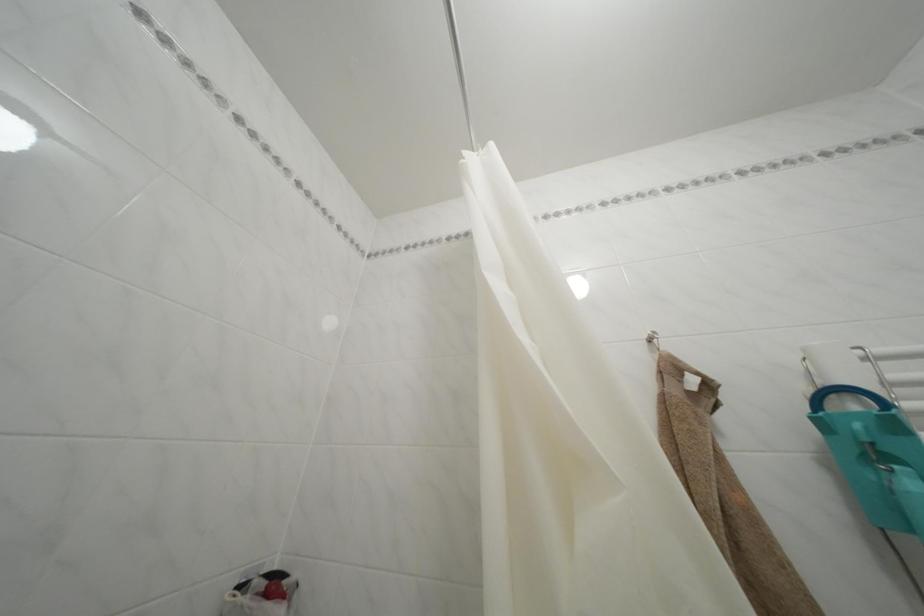
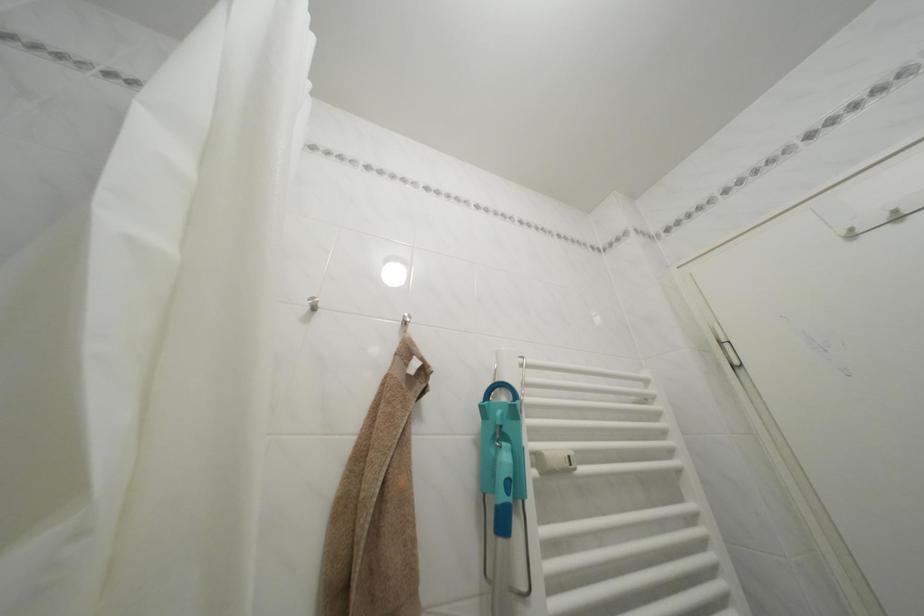
Question: The images are taken continuously from a first-person perspective. In which direction is your viewpoint rotating?

Choices:
 (A) Left
 (B) Right
 (C) Up
 (D) Down

Answer: (B)